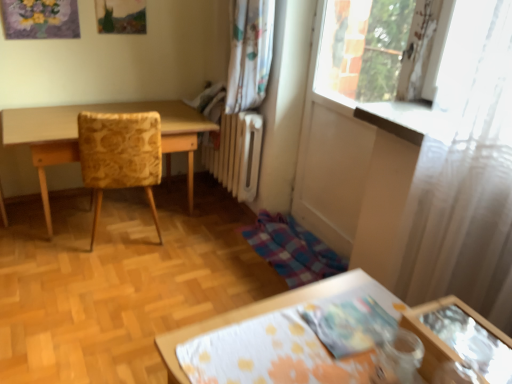
Question: From a real-world perspective, is light wood table at left over white sheer curtain at right?

Choices:
 (A) yes
 (B) no

Answer: (B)

Question: Considering the relative sizes of light wood table at left and white sheer curtain at right in the image provided, is light wood table at left shorter than white sheer curtain at right?

Choices:
 (A) no
 (B) yes

Answer: (B)

Question: From a real-world perspective, does light wood table at left sit lower than white sheer curtain at right?

Choices:
 (A) yes
 (B) no

Answer: (A)

Question: Is light wood table at left to the right of white sheer curtain at right from the viewer's perspective?

Choices:
 (A) no
 (B) yes

Answer: (A)

Question: Considering the relative sizes of light wood table at left and white sheer curtain at right in the image provided, is light wood table at left thinner than white sheer curtain at right?

Choices:
 (A) yes
 (B) no

Answer: (B)

Question: Is point (201, 117) positioned closer to the camera than point (509, 269)?

Choices:
 (A) closer
 (B) farther

Answer: (B)

Question: From the image's perspective, relative to white sheer curtain at right, is light wood table at left above or below?

Choices:
 (A) above
 (B) below

Answer: (A)

Question: Considering the positions of light wood table at left and white sheer curtain at right in the image, is light wood table at left taller or shorter than white sheer curtain at right?

Choices:
 (A) tall
 (B) short

Answer: (B)

Question: Do you think light wood table at left is within white sheer curtain at right, or outside of it?

Choices:
 (A) outside
 (B) inside

Answer: (A)

Question: Would you say light wood table at left is to the left or to the right of yellow floral fabric chair at left in the picture?

Choices:
 (A) left
 (B) right

Answer: (A)

Question: From a real-world perspective, is light wood table at left physically located above or below yellow floral fabric chair at left?

Choices:
 (A) above
 (B) below

Answer: (B)

Question: Looking at the image, does light wood table at left seem bigger or smaller compared to yellow floral fabric chair at left?

Choices:
 (A) big
 (B) small

Answer: (A)

Question: Is light wood table at left inside or outside of yellow floral fabric chair at left?

Choices:
 (A) inside
 (B) outside

Answer: (B)

Question: Is point (126, 185) positioned closer to the camera than point (187, 155)?

Choices:
 (A) farther
 (B) closer

Answer: (B)

Question: Considering the positions of yellow floral fabric chair at left and light wood table at left in the image, is yellow floral fabric chair at left wider or thinner than light wood table at left?

Choices:
 (A) thin
 (B) wide

Answer: (A)